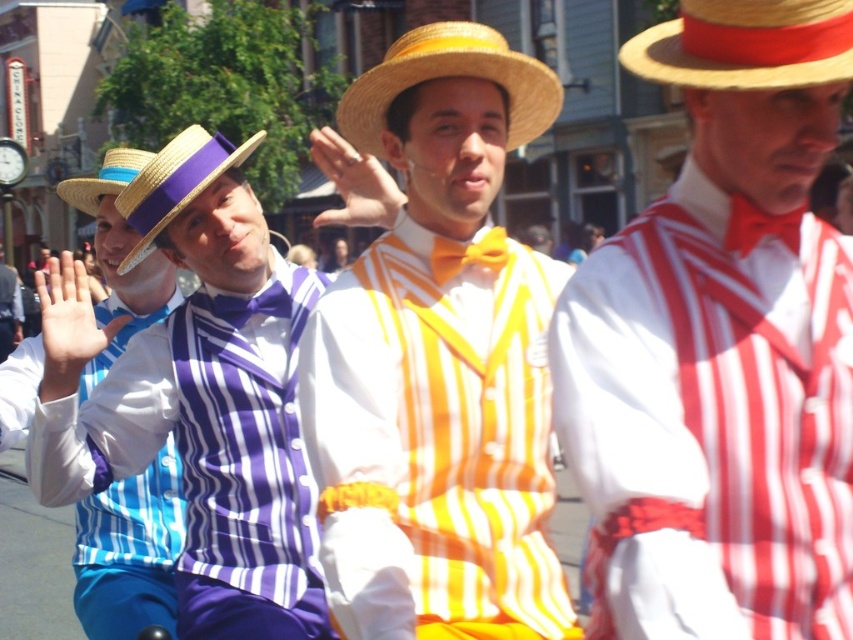
Question: Can you confirm if yellow striped vest at center is wider than matte blue vest at left?

Choices:
 (A) no
 (B) yes

Answer: (A)

Question: Which of the following is the closest to the observer?

Choices:
 (A) orange satin bow tie at center
 (B) red and white striped shirt at center

Answer: (B)

Question: Based on their relative distances, which object is farther from the matte red bow tie at center?

Choices:
 (A) straw hat at center
 (B) matte blue vest at left

Answer: (B)

Question: From the image, what is the correct spatial relationship of matte purple vest at center in relation to matte blue vest at left?

Choices:
 (A) above
 (B) below

Answer: (B)

Question: Is matte purple vest at center wider than matte purple bow tie at center?

Choices:
 (A) yes
 (B) no

Answer: (A)

Question: Which is farther from the matte purple vest at center?

Choices:
 (A) matte blue vest at left
 (B) matte straw cowboy hat at upper right
 (C) orange satin bow tie at center

Answer: (B)